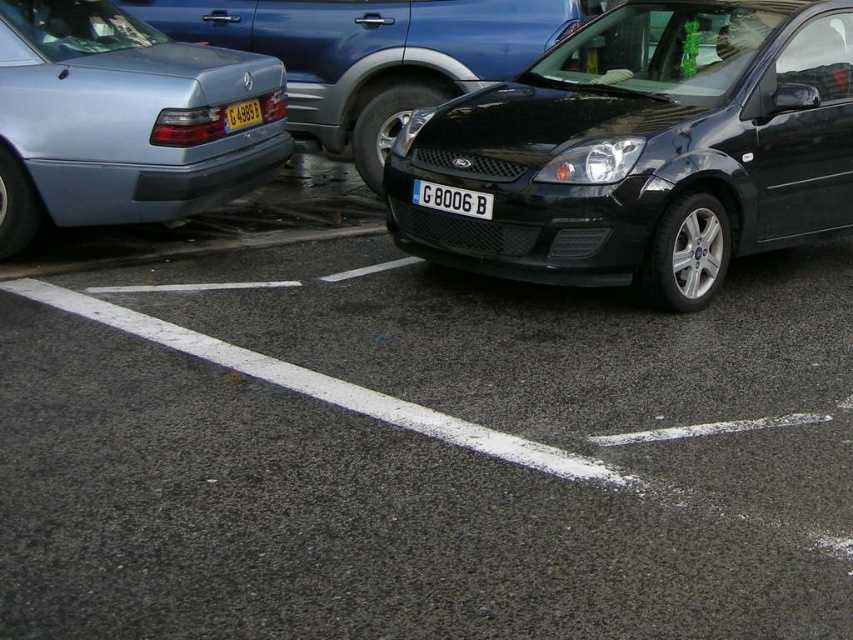
Question: Which of the following is the closest to the observer?

Choices:
 (A) metallic blue sedan at left
 (B) black asphalt at center
 (C) black plastic license plate at center
 (D) metallic silver sedan at left

Answer: (B)

Question: Does black glossy car at center have a greater width compared to metallic blue sedan at left?

Choices:
 (A) no
 (B) yes

Answer: (B)

Question: Which object appears farthest from the camera in this image?

Choices:
 (A) black plastic license plate at center
 (B) yellow matte license plate at center

Answer: (B)

Question: Observing the image, what is the correct spatial positioning of black glossy car at center in reference to yellow matte license plate at center?

Choices:
 (A) left
 (B) right

Answer: (B)

Question: Does black asphalt at center appear under metallic silver sedan at left?

Choices:
 (A) yes
 (B) no

Answer: (A)

Question: Which point is closer to the camera?

Choices:
 (A) (469, 205)
 (B) (469, 138)
 (C) (230, 106)
 (D) (144, 10)

Answer: (A)